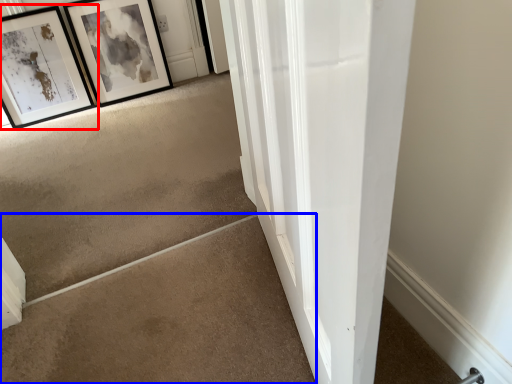
Question: Which object is closer to the camera taking this photo, picture frame (highlighted by a red box) or concrete (highlighted by a blue box)?

Choices:
 (A) picture frame
 (B) concrete

Answer: (B)